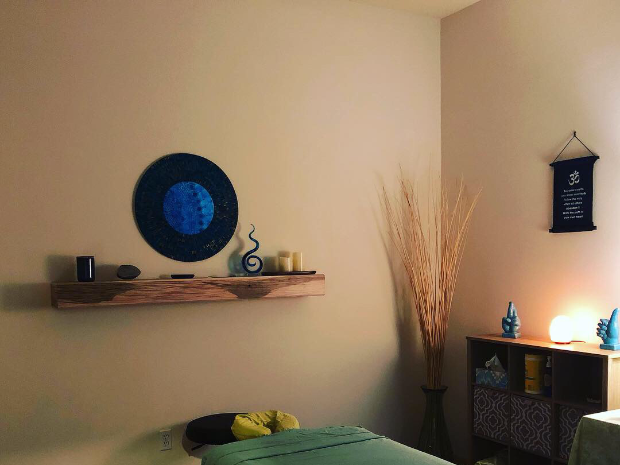
The height and width of the screenshot is (465, 620). What are the coordinates of `decorative bins` in the screenshot? It's located at (485, 417), (525, 423), (576, 422).